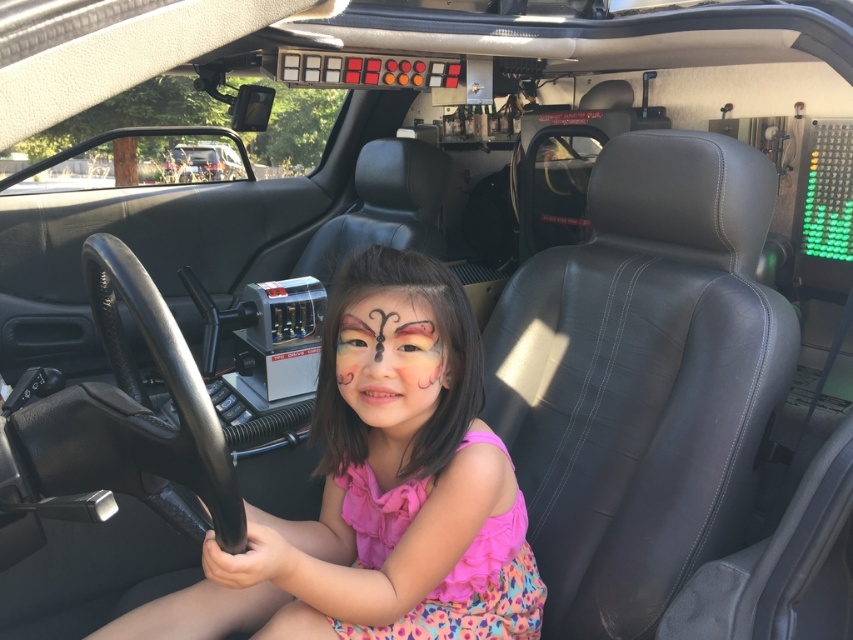
You are inside the transformed car and want to reach the point marked at coordinates (x=404, y=301). If your arm can extend 3.5 feet, can you comfortably reach it?

The point marked at coordinates (x=404, y=301) is 4.09 feet away from the camera, which is beyond the 3.5 feet reach of your arm. Therefore, you cannot comfortably reach it.

You are a makeup artist standing in front of the car and see the matte pink face paint at center. Can you reach it without moving your position?

The matte pink face paint at center is 4.02 feet away from viewer, so you cannot reach it without moving closer.

You are a passenger in the futuristic car and need to reach both the pink fabric dress at center and the matte pink face paint at center. Which object is closer to your hand if you are sitting in the driver seat?

The pink fabric dress at center is 11.46 inches away from matte pink face paint at center, so the distance between them is 11.46 inches. However, since both objects are at the center of the car, their proximity to your hand would depend on your exact position. Without additional information about their specific locations relative to the driver seat, it is impossible to determine which is closer.